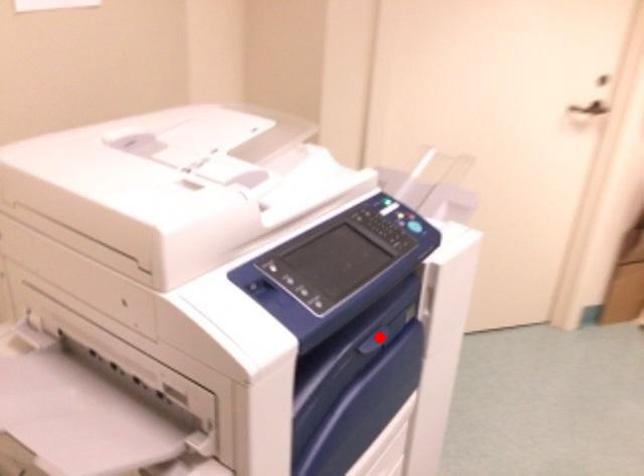
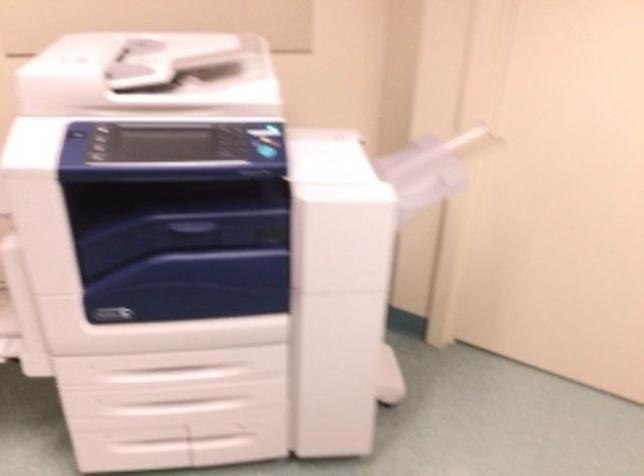
Question: I am providing you with two images of the same scene from different viewpoints. Given a red point in image1, look at the same physical point in image2. Is it:

Choices:
 (A) Closer to the viewpoint
 (B) Farther from the viewpoint

Answer: (B)